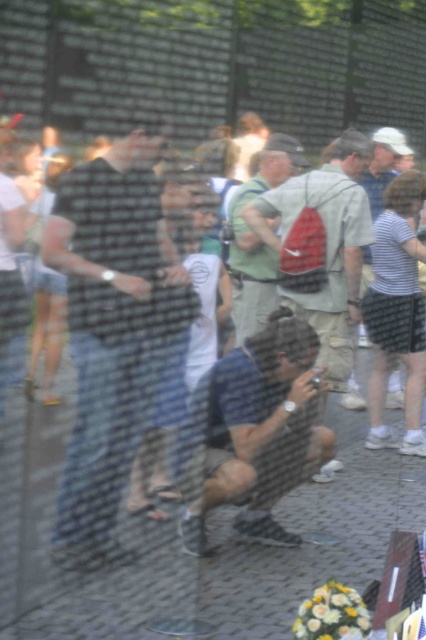
Question: Does dark plaid shirt at center appear on the left side of green fabric backpack at center?

Choices:
 (A) yes
 (B) no

Answer: (A)

Question: Which of the following is the closest to the observer?

Choices:
 (A) dark plaid shirt at center
 (B) red backpack at center

Answer: (A)

Question: Estimate the real-world distances between objects in this image. Which object is farther from the dark plaid shirt at center?

Choices:
 (A) red backpack at center
 (B) green fabric backpack at center

Answer: (A)

Question: Is dark plaid shirt at center above red backpack at center?

Choices:
 (A) no
 (B) yes

Answer: (A)

Question: Is red backpack at center smaller than green fabric backpack at center?

Choices:
 (A) yes
 (B) no

Answer: (B)

Question: Which point is closer to the camera taking this photo?

Choices:
 (A) (337, 468)
 (B) (258, 189)
 (C) (132, 445)

Answer: (C)